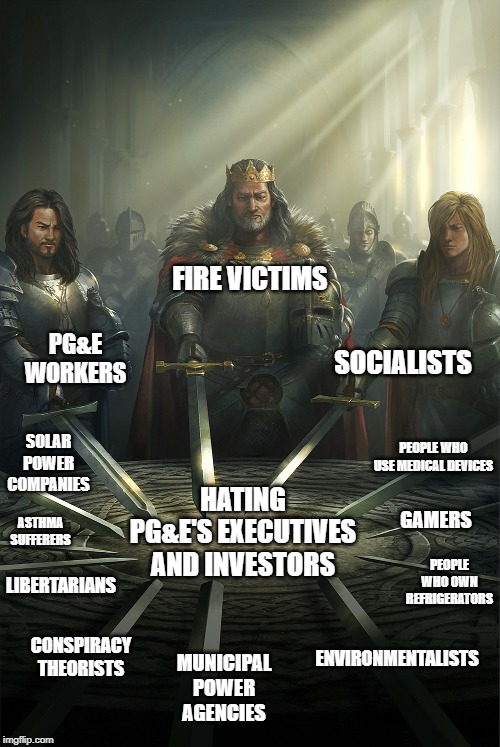
Where is `handle`? The image size is (500, 747). handle is located at coordinates (61, 402), (194, 358), (345, 391).